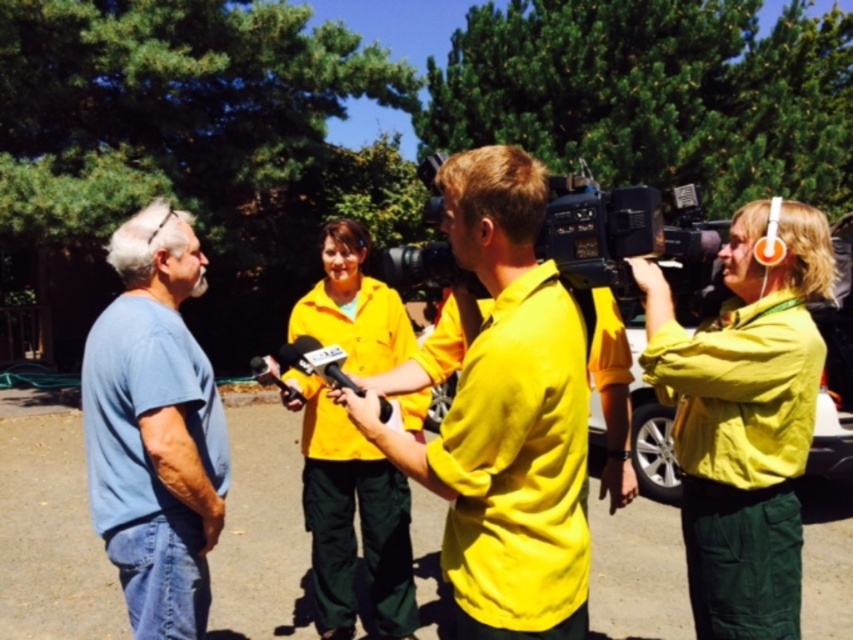
Who is more distant from viewer, (347, 406) or (160, 204)?

Positioned behind is point (160, 204).

Where is `yellow matte shirt at center`? The image size is (853, 640). yellow matte shirt at center is located at coordinates coord(503,413).

Where is `yellow matte shirt at center`? The image size is (853, 640). yellow matte shirt at center is located at coordinates (503, 413).

Who is shorter, blue cotton shirt at left or black plastic video camera at center?

black plastic video camera at center is shorter.

Between point (115, 349) and point (386, 250), which one is positioned behind?

Positioned behind is point (386, 250).

At what (x,y) coordinates should I click in order to perform the action: click on blue cotton shirt at left. Please return your answer as a coordinate pair (x, y). Image resolution: width=853 pixels, height=640 pixels. Looking at the image, I should click on (154, 428).

Describe the element at coordinates (503, 413) in the screenshot. I see `yellow matte shirt at center` at that location.

Locate an element on the screen. yellow matte shirt at center is located at coordinates (503, 413).